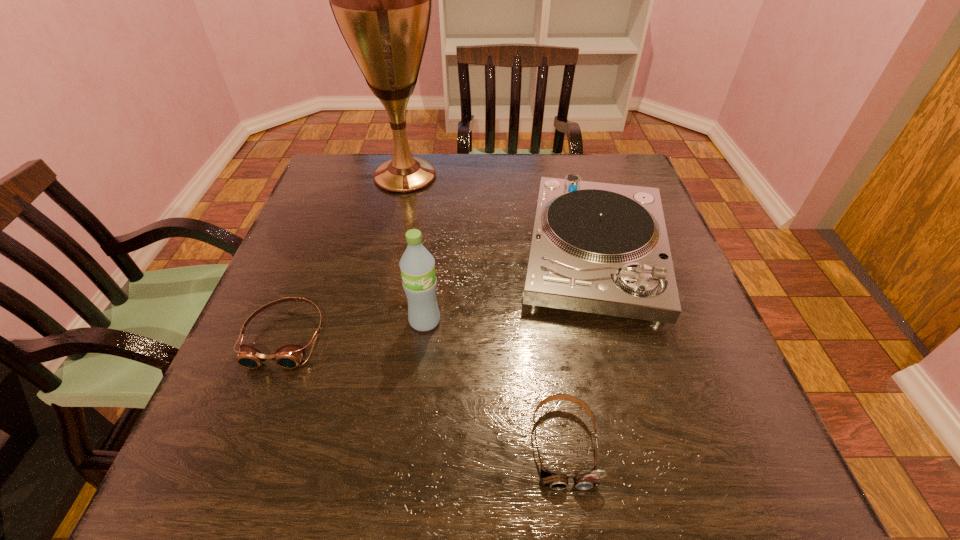
In the image, there is a desktop. Identify the location of vacant space at the left edge. (256, 372).

Locate an element on the screen. This screenshot has width=960, height=540. free space at the right edge is located at coordinates 682,361.

Locate an element on the screen. free space at the far left corner of the desktop is located at coordinates (316, 190).

In the image, there is a desktop. What are the coordinates of `vacant space at the near left corner` in the screenshot? It's located at (236, 500).

Locate an element on the screen. This screenshot has width=960, height=540. blank area at the far right corner is located at coordinates (626, 182).

Locate an element on the screen. The width and height of the screenshot is (960, 540). vacant space at the near right corner of the desktop is located at coordinates (723, 480).

Identify the location of free spot between the water bottle and the record player. (510, 288).

The height and width of the screenshot is (540, 960). What are the coordinates of `vacant space in between the tallest object and the left goggles` in the screenshot? It's located at (346, 256).

Where is `free spot between the nearer goggles and the second tallest object`? free spot between the nearer goggles and the second tallest object is located at coordinates (494, 382).

At what (x,y) coordinates should I click in order to perform the action: click on vacant point located between the record player and the left goggles. Please return your answer as a coordinate pair (x, y). Image resolution: width=960 pixels, height=540 pixels. Looking at the image, I should click on tap(441, 296).